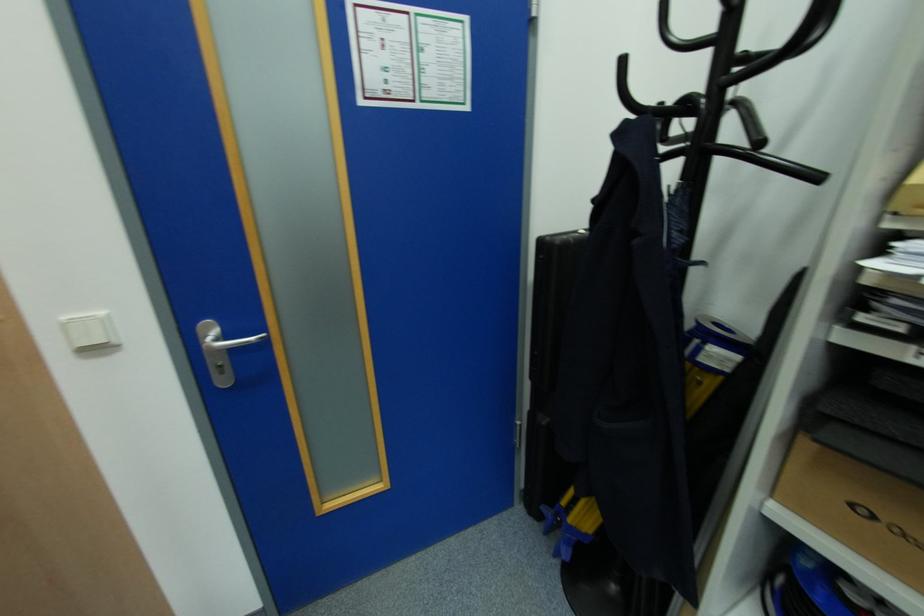
Where is `silver door handle`? The width and height of the screenshot is (924, 616). silver door handle is located at coordinates (221, 351).